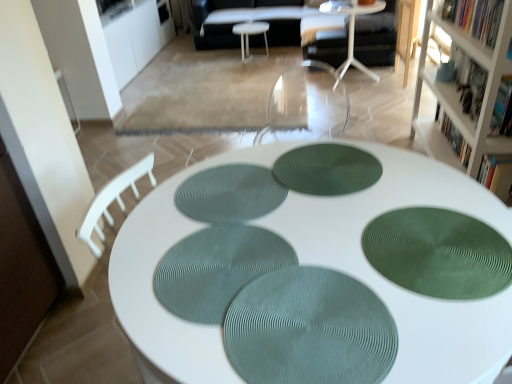
The height and width of the screenshot is (384, 512). In order to click on vacant space that is in between green textured placemat at center, which is the first mat from left to right, and teal textured placemat at center, the second mat positioned from the left in this screenshot , I will do `click(232, 226)`.